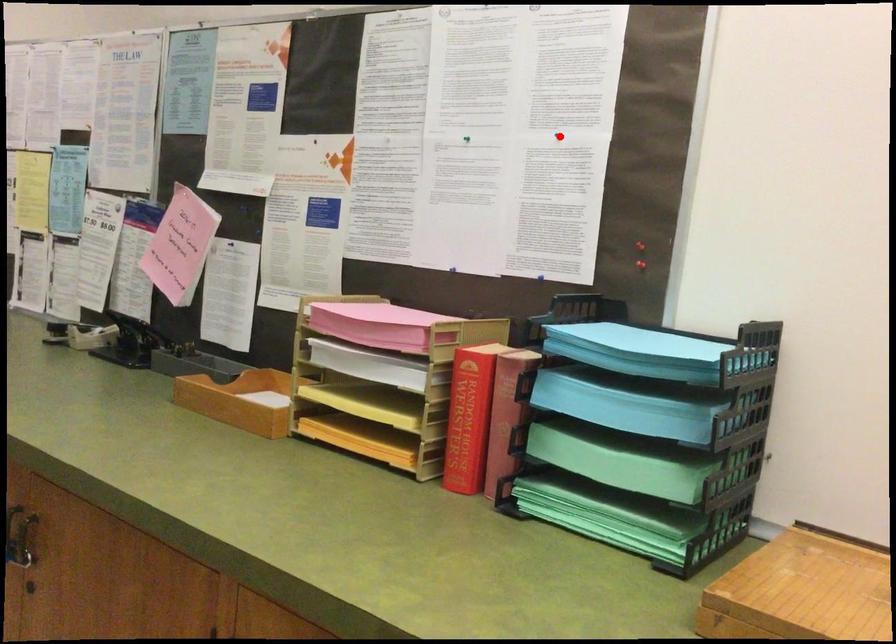
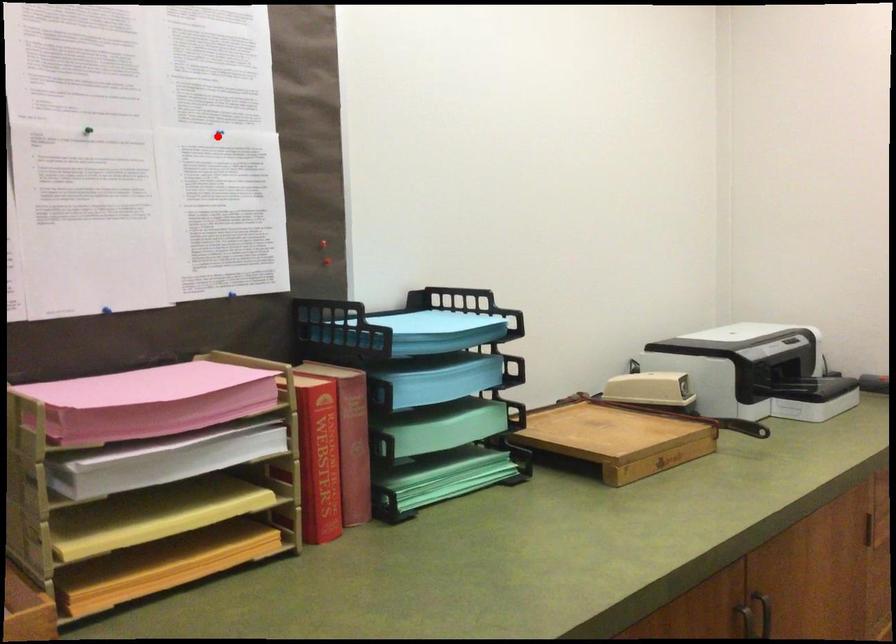
I am providing you with two images of the same scene from different viewpoints. A red point is marked on the first image and another point is marked on the second image. Is the red point in image1 aligned with the point shown in image2?

Yes